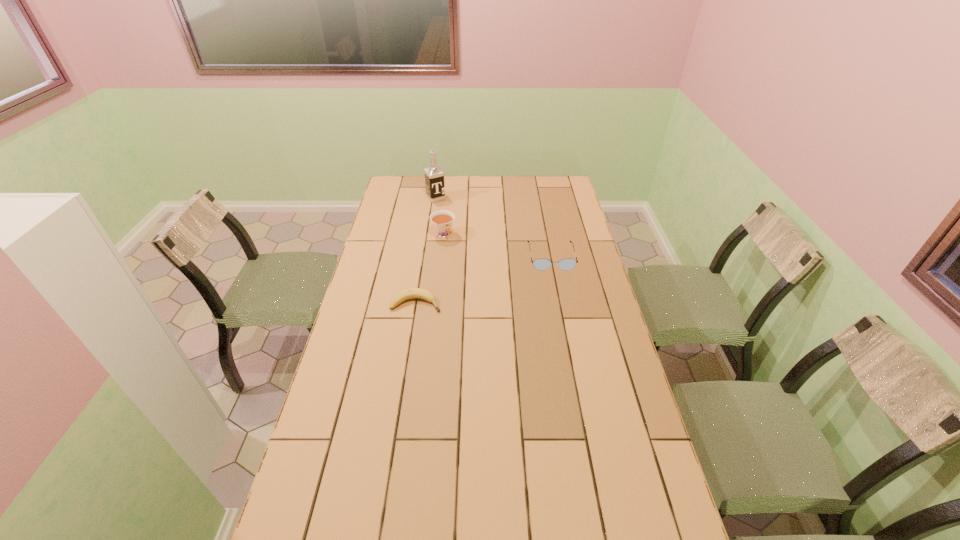
Locate an element on the screen. free spot on the desktop that is between the shortest object and the second shortest object and is positioned on the side of the third shortest object with the handle is located at coordinates (480, 281).

Where is `vacant spot on the desktop that is between the banana and the spectacles and is positioned on the front label of the vodka`? Image resolution: width=960 pixels, height=540 pixels. vacant spot on the desktop that is between the banana and the spectacles and is positioned on the front label of the vodka is located at coordinates (501, 274).